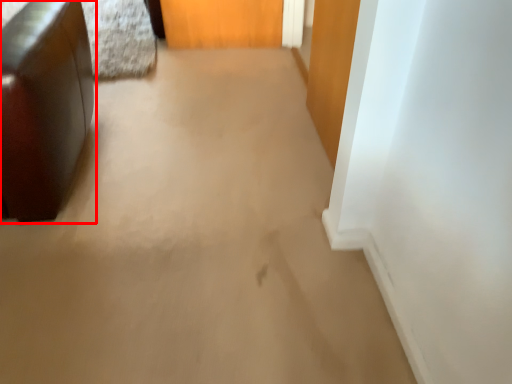
Question: From the image's perspective, where is furniture (annotated by the red box) located in relation to door in the image?

Choices:
 (A) below
 (B) above

Answer: (A)